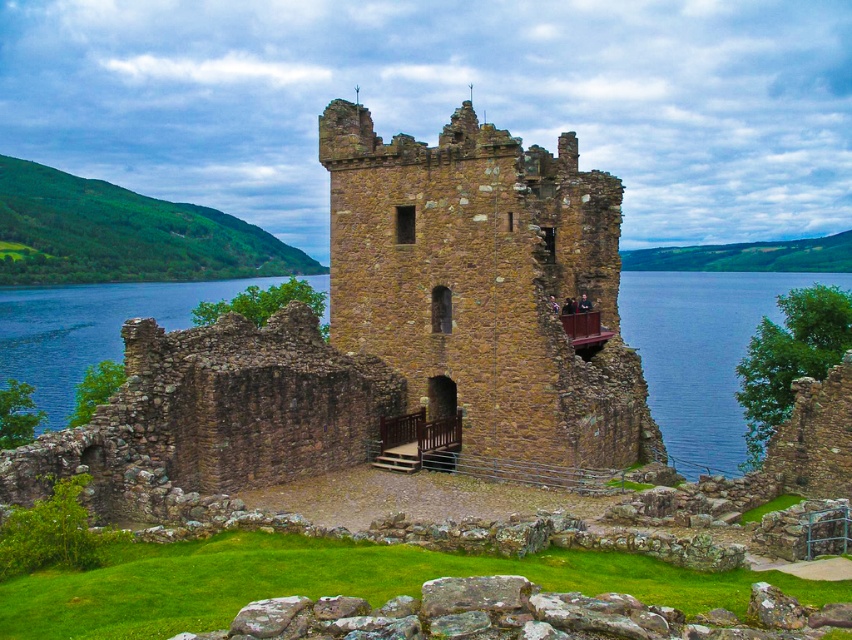
Is brown stone water at center shorter than blue water at lower right?

No.

Is brown stone water at center thinner than blue water at lower right?

No.

Measure the distance between brown stone water at center and camera.

81.41 meters

Locate an element on the screen. The image size is (852, 640). brown stone water at center is located at coordinates (701, 353).

Is brown stone castle at center positioned in front of brown stone tower at center?

Yes.

Measure the distance between brown stone castle at center and brown stone tower at center.

brown stone castle at center and brown stone tower at center are 1.91 meters apart from each other.

The image size is (852, 640). In order to click on brown stone castle at center in this screenshot , I will do `click(389, 333)`.

Does point (312, 442) come farther from viewer compared to point (26, 369)?

That is False.

Who is higher up, brown stone castle at center or brown stone water at center?

brown stone water at center

At what (x,y) coordinates should I click in order to perform the action: click on brown stone castle at center. Please return your answer as a coordinate pair (x, y). The width and height of the screenshot is (852, 640). Looking at the image, I should click on (389, 333).

This screenshot has height=640, width=852. In order to click on brown stone castle at center in this screenshot , I will do click(x=389, y=333).